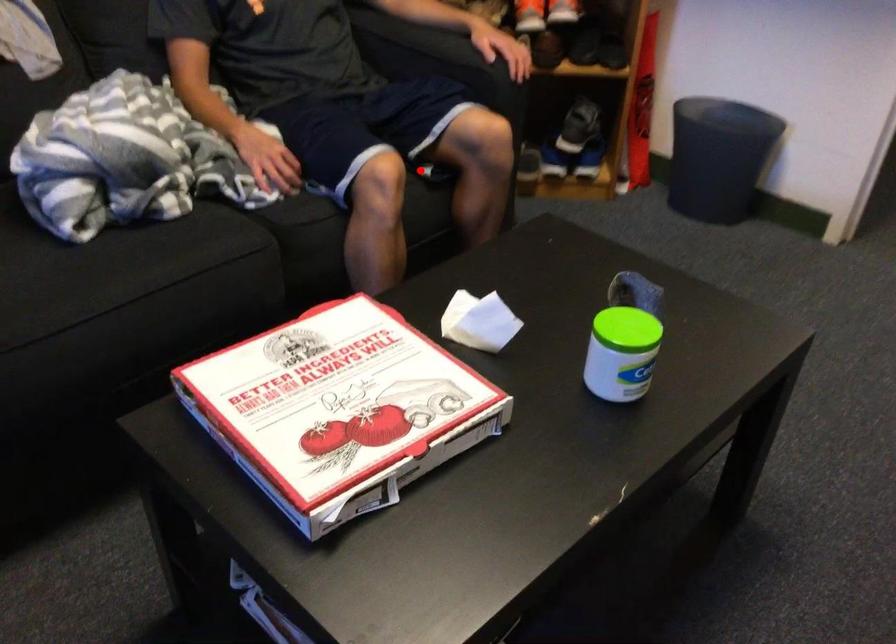
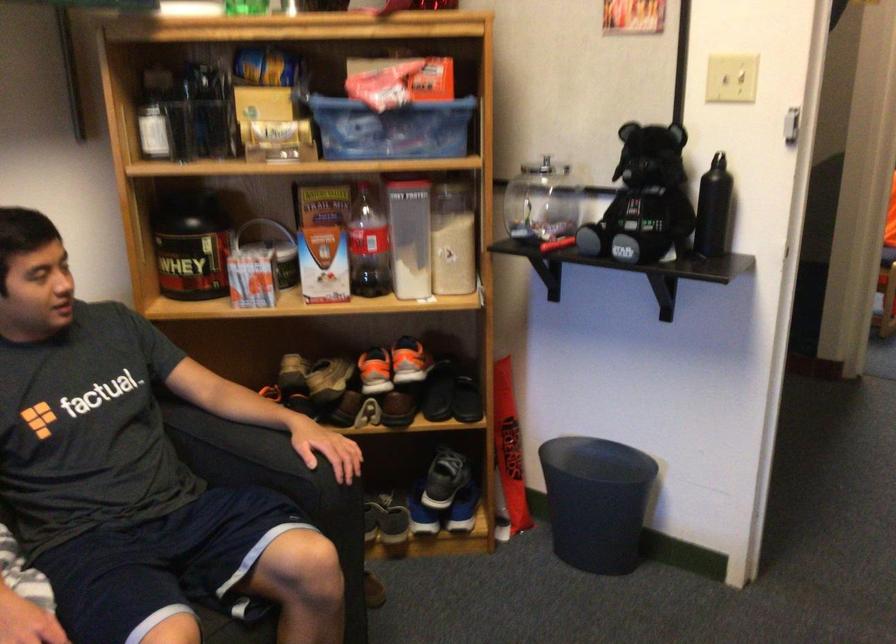
Question: I am providing you with two images of the same scene from different viewpoints. Image1 has a red point marked. In image2, the corresponding 3D location appears at what relative position? Reply with the corresponding letter.

Choices:
 (A) Closer
 (B) Farther

Answer: (A)